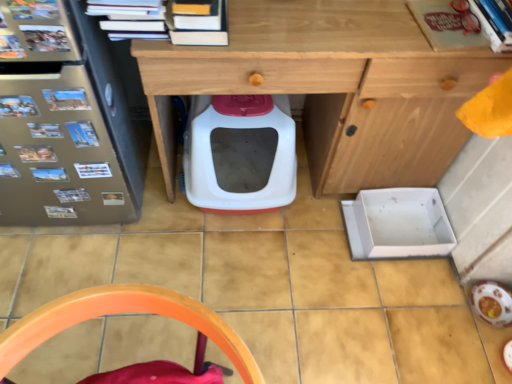
Question: Is white plastic litter box at center bigger or smaller than hardcover books at upper center, the 1th book positioned from the left?

Choices:
 (A) small
 (B) big

Answer: (B)

Question: From the image's perspective, is white plastic litter box at center located above or below hardcover books at upper center, the third book when ordered from right to left?

Choices:
 (A) above
 (B) below

Answer: (B)

Question: Which object is positioned farthest from the metallic silver fridge at left?

Choices:
 (A) hardcover books at upper center, the third book when ordered from right to left
 (B) matte red book at upper right, which is the 2th book from right to left
 (C) orange plastic chair at lower center
 (D) wooden desk at center
 (E) white plastic litter box at center

Answer: (B)

Question: Which object is positioned closest to the metallic silver fridge at left?

Choices:
 (A) hardcover book at upper right, which is the 3th book from left to right
 (B) matte red book at upper right, which appears as the 2th book when viewed from the left
 (C) wooden desk at center
 (D) white plastic litter box at center
 (E) orange plastic chair at lower center

Answer: (D)